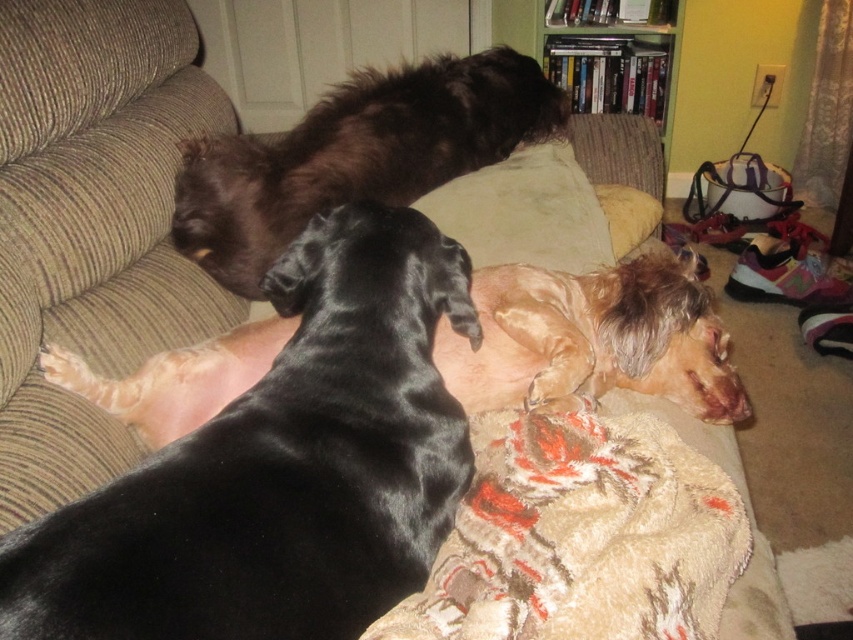
Question: Is brown fabric couch at center above beige knitted blanket at center?

Choices:
 (A) no
 (B) yes

Answer: (B)

Question: Among these points, which one is farthest from the camera?

Choices:
 (A) (318, 116)
 (B) (28, 305)

Answer: (A)

Question: Does shiny black dog at upper center have a greater width compared to beige fabric pillow at center?

Choices:
 (A) no
 (B) yes

Answer: (B)

Question: Which point is farther to the camera?

Choices:
 (A) shiny brown dog at center
 (B) shiny black dog at center
 (C) shiny black dog at upper center
 (D) beige fabric pillow at center

Answer: (D)

Question: Based on their relative distances, which object is farther from the shiny black dog at upper center?

Choices:
 (A) shiny brown dog at center
 (B) brown fabric couch at center

Answer: (A)

Question: Is shiny brown dog at center smaller than shiny black dog at center?

Choices:
 (A) no
 (B) yes

Answer: (B)